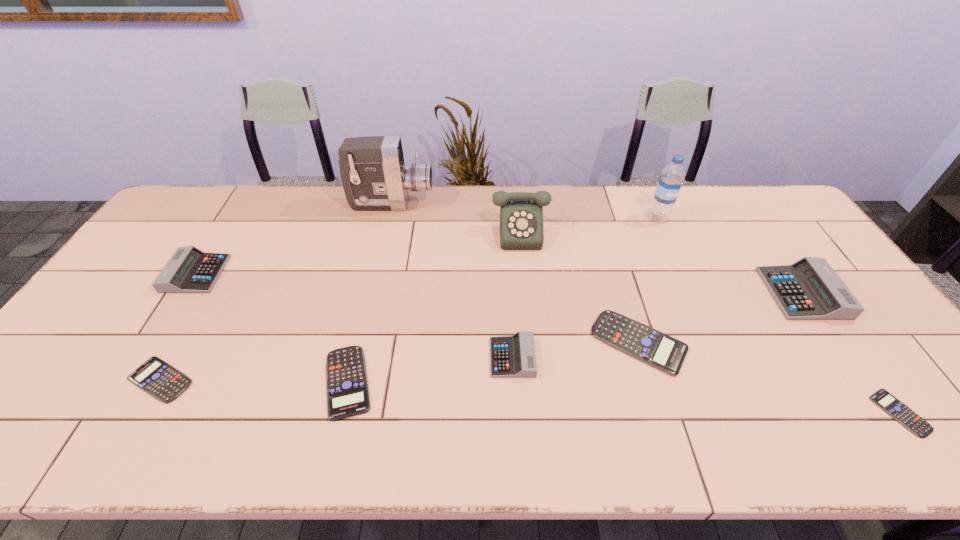
I want to click on the seventh tallest object, so click(x=661, y=351).

Where is `the biggest blue calculator`? the biggest blue calculator is located at coordinates (661, 351).

Image resolution: width=960 pixels, height=540 pixels. I want to click on the third smallest blue calculator, so (346, 377).

Image resolution: width=960 pixels, height=540 pixels. Find the location of `the fifth tallest calculator`. the fifth tallest calculator is located at coordinates (346, 377).

Image resolution: width=960 pixels, height=540 pixels. In order to click on the leftmost blue calculator in this screenshot , I will do `click(156, 377)`.

Identify the location of the second smallest blue calculator. (156, 377).

At what (x,y) coordinates should I click in order to perform the action: click on the rightmost blue calculator. Please return your answer as a coordinate pair (x, y). This screenshot has height=540, width=960. Looking at the image, I should click on (882, 398).

At what (x,y) coordinates should I click in order to perform the action: click on the smallest blue calculator. Please return your answer as a coordinate pair (x, y). The height and width of the screenshot is (540, 960). Looking at the image, I should click on (882, 398).

Identify the location of vacant space situated 0.080m at the front of the camcorder, highlighting the lens. (456, 204).

You are a GUI agent. You are given a task and a screenshot of the screen. Output one action in this format:
    pyautogui.click(x=<x>, y=<y>)
    Task: Click on the free space located 0.090m on the label of the water bottle
    The width and height of the screenshot is (960, 540).
    Given the screenshot: What is the action you would take?
    pyautogui.click(x=669, y=242)